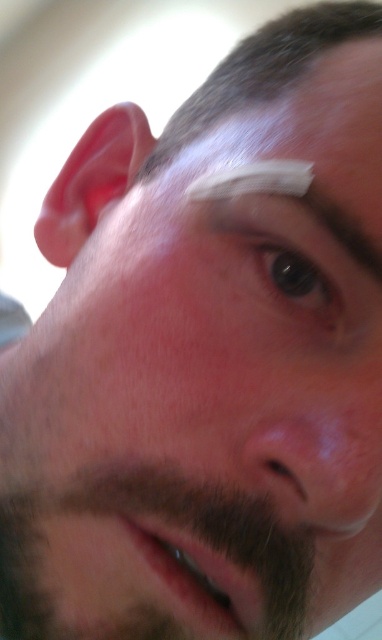
You are a photographer adjusting lighting for a portrait. You need to ensure the dark brown fuzzy beard at lower left and the black glossy eye at center are both well lit. Given their sizes, which object requires a wider light source to capture details effectively?

The dark brown fuzzy beard at lower left requires a wider light source because it is larger in size than the black glossy eye at center, necessitating more coverage to adequately illuminate its details.

You are a dermatologist examining a patient. You notice the dark brown fuzzy beard at lower left and the white matte bandage at upper center. Which of these two items has a larger size?

The dark brown fuzzy beard at lower left is bigger than the white matte bandage at upper center according to the description.